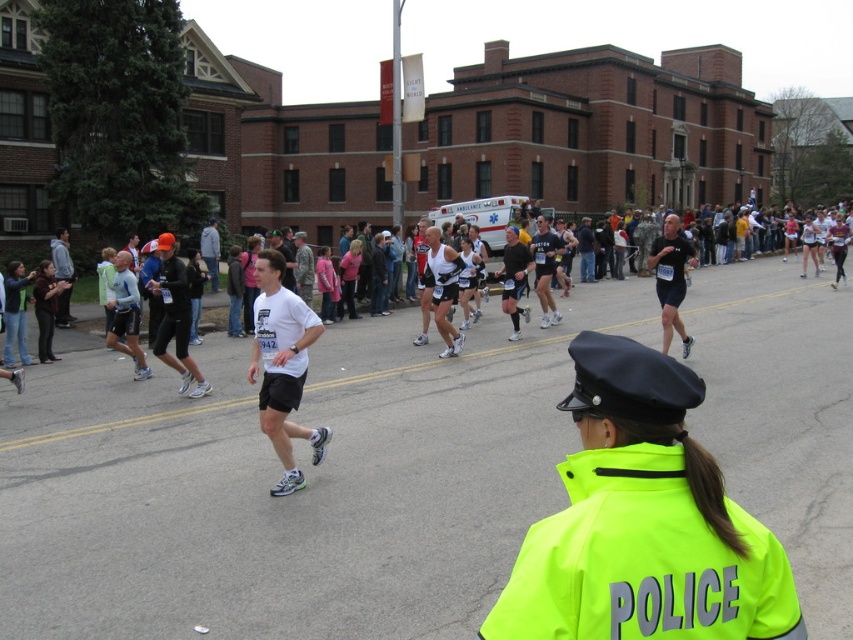
Who is taller, neon yellow jacket at center or matte black shorts at center?

With more height is matte black shorts at center.

Identify the location of neon yellow jacket at center. Image resolution: width=853 pixels, height=640 pixels. (642, 522).